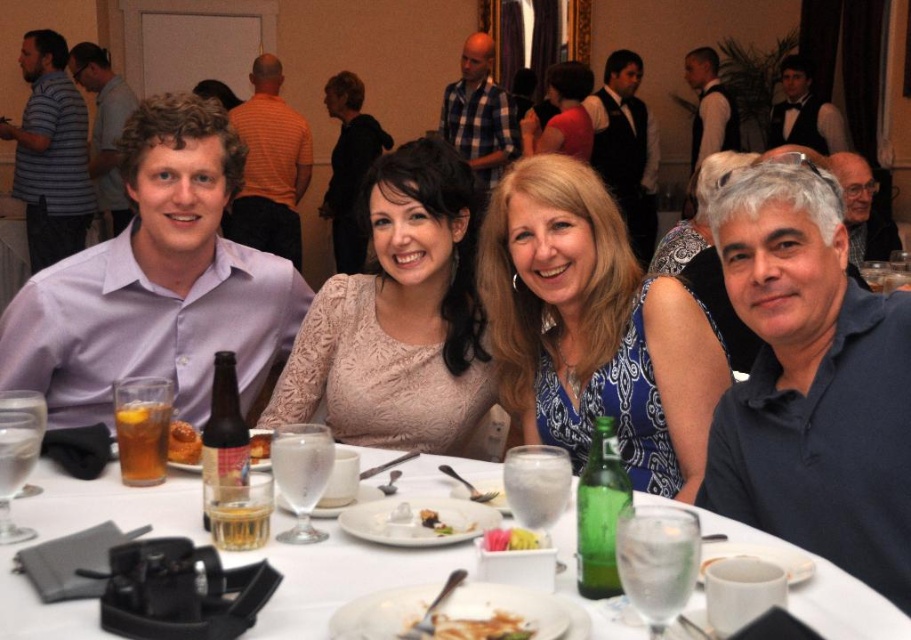
You are sitting at the table and want to reach for the blue plaid shirt at center. What coordinates should you aim for?

The blue plaid shirt at center is located at point (479, 113), so you should aim for those coordinates.

You are a guest at this dinner and need to place your napkin on the table without covering any of the objects. Given the black satin vest at upper center and the translucent glass at table center, which object should you avoid placing the napkin near to ensure it doesn

You should avoid placing the napkin near the black satin vest at upper center because it is taller than the translucent glass at table center, so placing the napkin there might cover it.